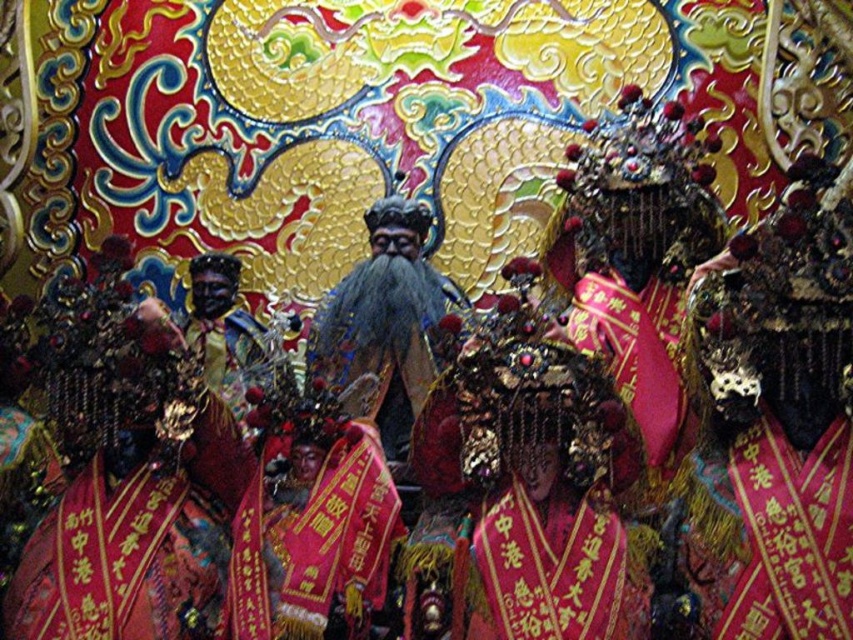
You are an event planner arranging a photo shoot at this traditional Chinese festival scene. You need to position a camera to capture both the velvet red banner at center and the shiny gold statue at center. Based on their positions, which object should the camera focus on first to ensure both are in frame?

The velvet red banner at center is to the right of the shiny gold statue at center, so the camera should focus on the shiny gold statue at center first to ensure both objects are included in the frame.